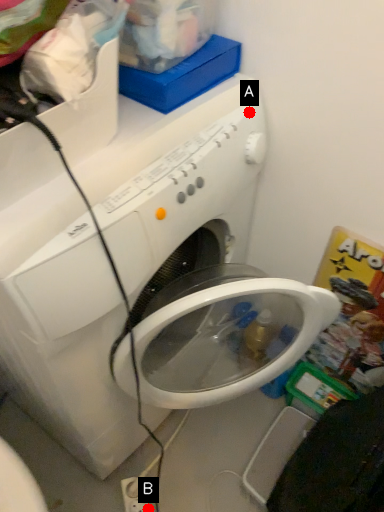
Question: Two points are circled on the image, labeled by A and B beside each circle. Which point appears farthest from the camera in this image?

Choices:
 (A) A is further
 (B) B is further

Answer: (B)